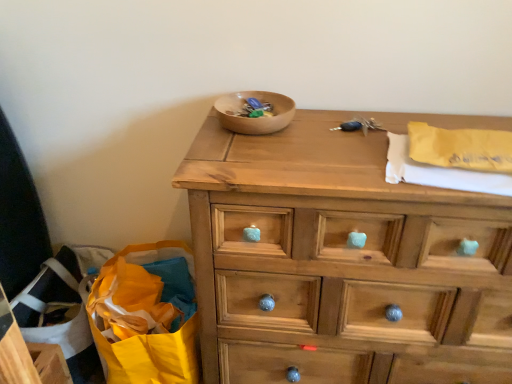
Question: Considering the relative sizes of wooden chest of drawers at center and wooden bowl at center in the image provided, is wooden chest of drawers at center smaller than wooden bowl at center?

Choices:
 (A) no
 (B) yes

Answer: (A)

Question: Is wooden chest of drawers at center turned away from wooden bowl at center?

Choices:
 (A) no
 (B) yes

Answer: (A)

Question: Does wooden chest of drawers at center appear on the right side of wooden bowl at center?

Choices:
 (A) no
 (B) yes

Answer: (B)

Question: Does wooden chest of drawers at center have a greater height compared to wooden bowl at center?

Choices:
 (A) no
 (B) yes

Answer: (B)

Question: Are wooden chest of drawers at center and wooden bowl at center beside each other?

Choices:
 (A) no
 (B) yes

Answer: (A)

Question: Considering the relative positions of wooden chest of drawers at center and wooden bowl at center in the image provided, is wooden chest of drawers at center to the left of wooden bowl at center from the viewer's perspective?

Choices:
 (A) no
 (B) yes

Answer: (A)

Question: Is wooden chest of drawers at center a part of yellow paper bag at lower left?

Choices:
 (A) no
 (B) yes

Answer: (A)

Question: Could you tell me if yellow paper bag at lower left is facing wooden chest of drawers at center?

Choices:
 (A) no
 (B) yes

Answer: (A)

Question: Is yellow paper bag at lower left not inside wooden chest of drawers at center?

Choices:
 (A) no
 (B) yes

Answer: (B)

Question: From a real-world perspective, is yellow paper bag at lower left located higher than wooden chest of drawers at center?

Choices:
 (A) no
 (B) yes

Answer: (A)

Question: Considering the relative positions of yellow paper bag at lower left and wooden chest of drawers at center in the image provided, is yellow paper bag at lower left to the right of wooden chest of drawers at center from the viewer's perspective?

Choices:
 (A) no
 (B) yes

Answer: (A)

Question: Considering the relative sizes of yellow paper bag at lower left and wooden chest of drawers at center in the image provided, is yellow paper bag at lower left bigger than wooden chest of drawers at center?

Choices:
 (A) yes
 (B) no

Answer: (B)

Question: Could you tell me if wooden bowl at center is facing wooden chest of drawers at center?

Choices:
 (A) no
 (B) yes

Answer: (A)